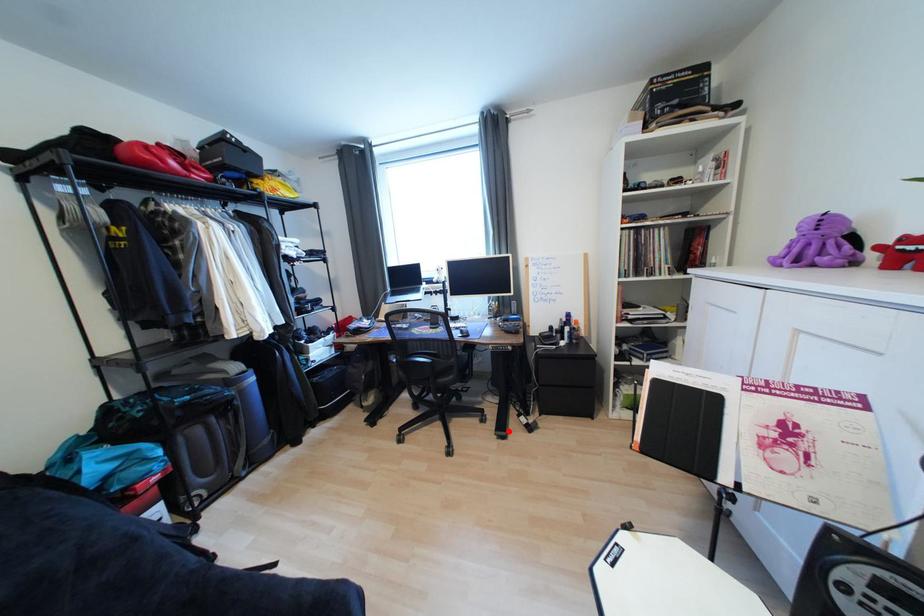
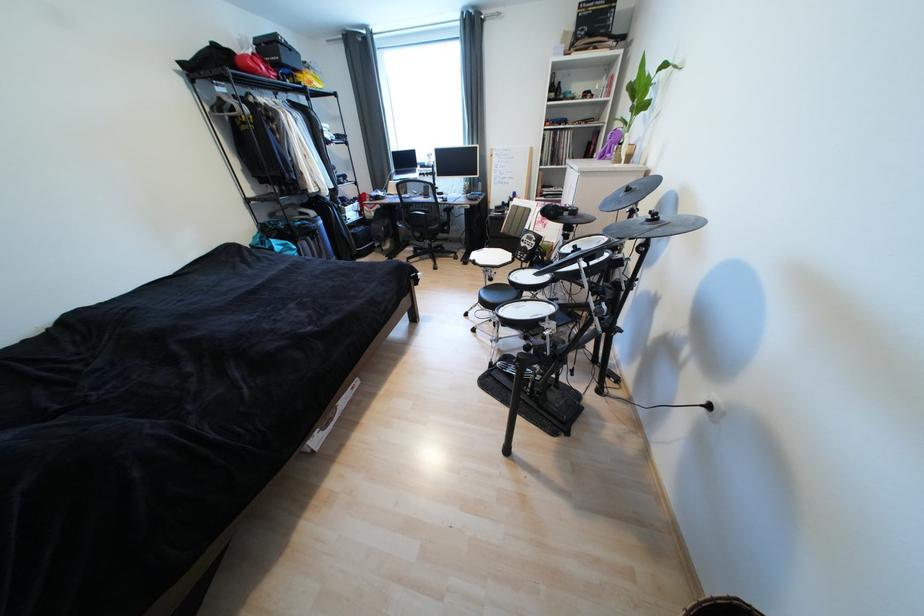
In the second image, find the point that corresponds to the highlighted location in the first image.

(472, 262)